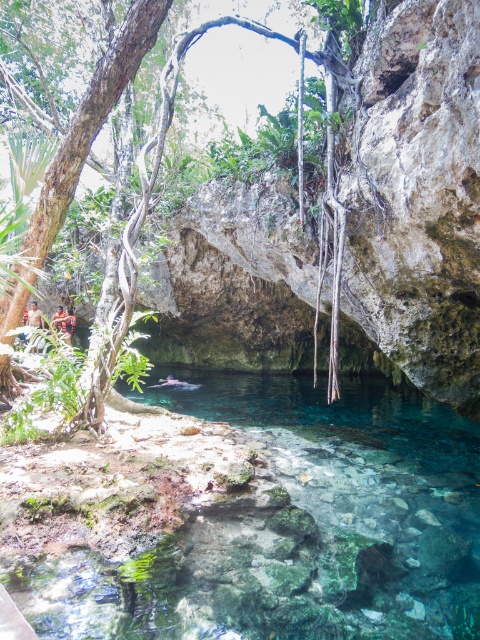
You are a photographer planning to capture the cenote from a specific vantage point. You notice the clear glass water at center and the green leafy tree at center. Which object will appear closer to the camera in your photo?

The clear glass water at center will appear closer to the camera because it is positioned in front of the green leafy tree at center.

You are planning to place a small wooden bench in the cenote scene. The bench requires a space that is wider than both the clear glass water at center and the green leafy tree at center. Based on the scene description, can you determine if there is enough space for the bench?

The clear glass water at center might be wider than the green leafy tree at center, so the bench may or may not fit depending on which is wider. However, since the exact width difference isn